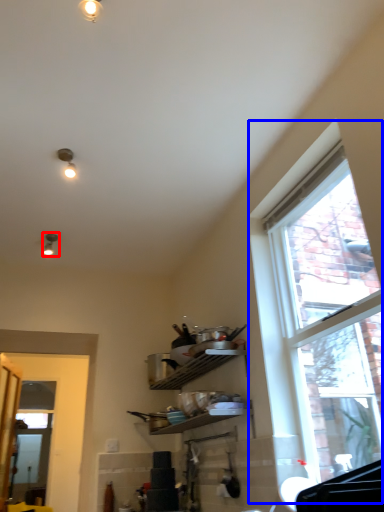
Question: Which of the following is the farthest to the observer, light fixture (highlighted by a red box) or window (highlighted by a blue box)?

Choices:
 (A) light fixture
 (B) window

Answer: (A)